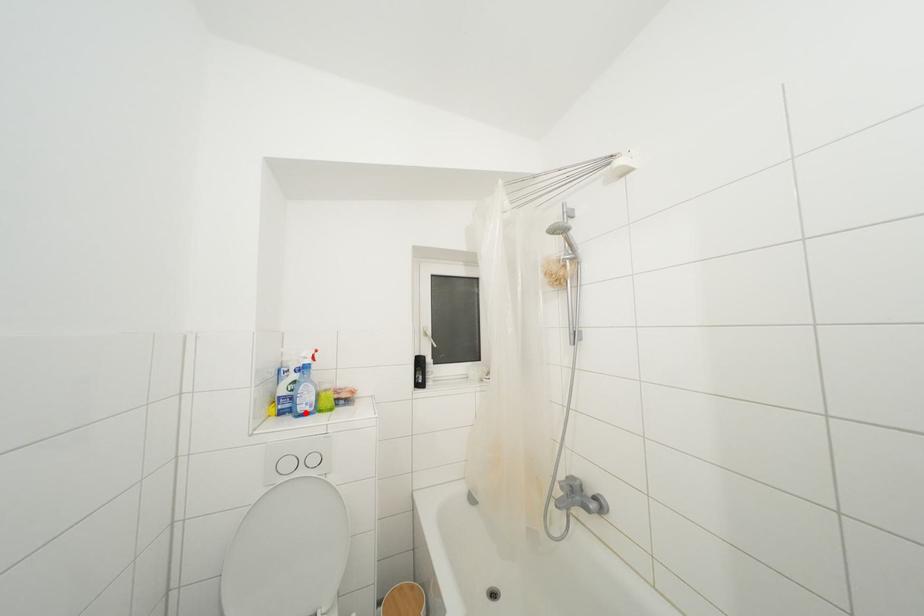
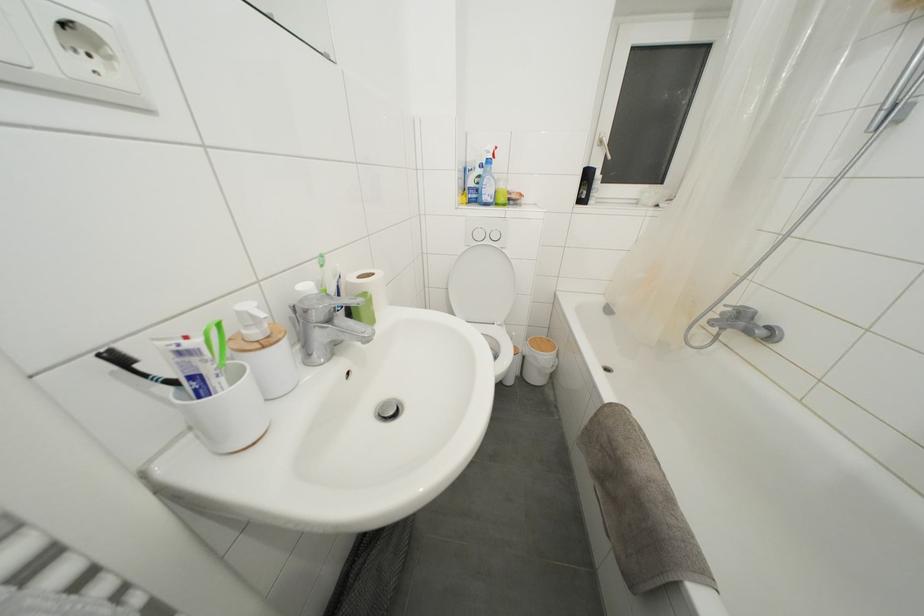
Question: A red point is marked in image1. In image2, is the corresponding 3D point closer to the camera or farther? Reply with the corresponding letter.

Choices:
 (A) The corresponding 3D point is closer.
 (B) The corresponding 3D point is farther.

Answer: (A)